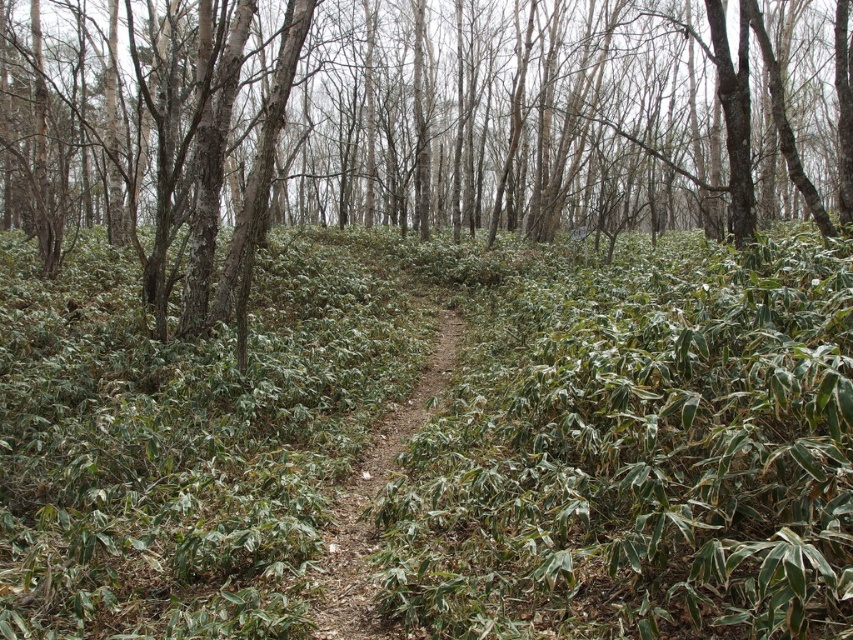
Can you confirm if green matte tree at center is smaller than dirt path at center?

Incorrect, green matte tree at center is not smaller in size than dirt path at center.

Locate an element on the screen. Image resolution: width=853 pixels, height=640 pixels. green matte tree at center is located at coordinates (415, 124).